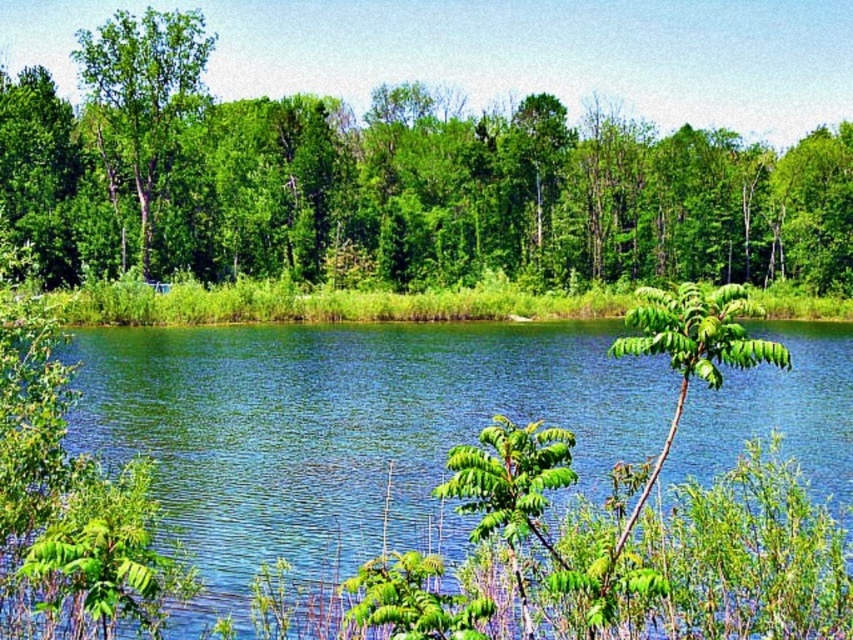
You are standing at the edge of the water and notice two green leafy trees in the upper part of the scene. Which tree, the green leafy tree at upper center or the green leafy tree at upper left, is closer to the water?

The green leafy tree at upper left is closer to the water because the green leafy tree at upper center is positioned over it, meaning it is farther away from the observer.